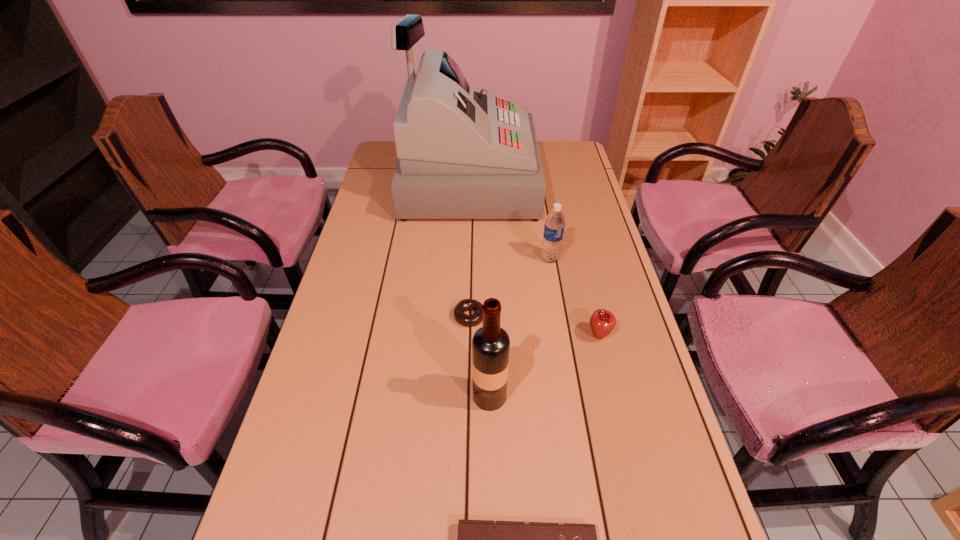
In order to click on the farthest object in this screenshot , I will do `click(462, 154)`.

The image size is (960, 540). I want to click on the tallest object, so click(x=462, y=154).

The width and height of the screenshot is (960, 540). I want to click on the second tallest object, so click(490, 345).

Image resolution: width=960 pixels, height=540 pixels. What are the coordinates of `the fifth farthest object` in the screenshot? It's located at (490, 345).

Find the location of a particular element. This screenshot has width=960, height=540. the fourth shortest object is located at coordinates (554, 226).

Locate an element on the screen. The height and width of the screenshot is (540, 960). the second farthest object is located at coordinates (554, 226).

Where is `apple`? apple is located at coordinates (602, 322).

Identify the location of the fourth tallest object. This screenshot has width=960, height=540. (602, 322).

This screenshot has height=540, width=960. What are the coordinates of `doughnut` in the screenshot? It's located at (476, 318).

At what (x,y) coordinates should I click in order to perform the action: click on vacant space situated on the keypad side of the tallest object. Please return your answer as a coordinate pair (x, y). The height and width of the screenshot is (540, 960). Looking at the image, I should click on (572, 180).